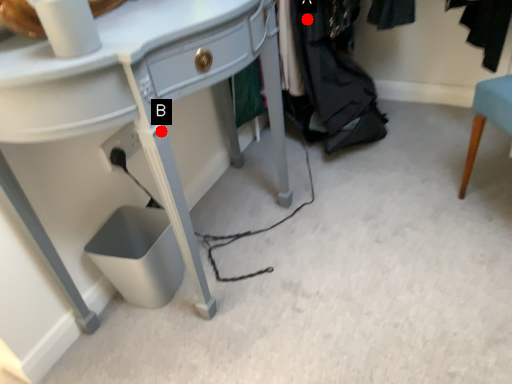
Question: Two points are circled on the image, labeled by A and B beside each circle. Which of the following is the closest to the observer?

Choices:
 (A) A is closer
 (B) B is closer

Answer: (B)